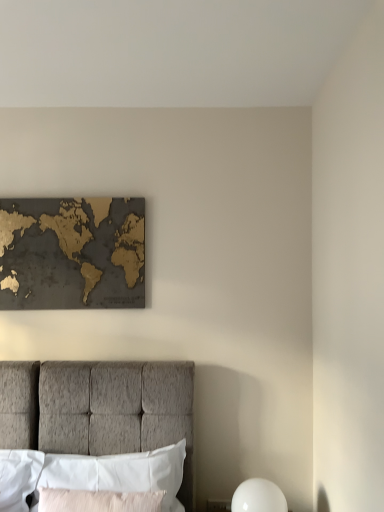
The image size is (384, 512). What do you see at coordinates (258, 497) in the screenshot?
I see `white glossy sphere at lower right` at bounding box center [258, 497].

Describe the element at coordinates (98, 501) in the screenshot. Image resolution: width=384 pixels, height=512 pixels. I see `light pink fabric pillow at lower center, the first pillow positioned from the front` at that location.

Identify the location of white glossy sphere at lower right. (258, 497).

Does white fabric pillow at lower left, positioned as the first pillow in back-to-front order, turn towards white glossy sphere at lower right?

No, white fabric pillow at lower left, positioned as the first pillow in back-to-front order, is not oriented towards white glossy sphere at lower right.

Is white glossy sphere at lower right a part of white fabric pillow at lower left, positioned as the first pillow in back-to-front order?

No, white glossy sphere at lower right is not a part of white fabric pillow at lower left, positioned as the first pillow in back-to-front order.

Considering the sizes of white fabric pillow at lower left, positioned as the first pillow in back-to-front order, and white glossy sphere at lower right in the image, is white fabric pillow at lower left, positioned as the first pillow in back-to-front order, bigger or smaller than white glossy sphere at lower right?

white fabric pillow at lower left, positioned as the first pillow in back-to-front order, is bigger than white glossy sphere at lower right.

I want to click on the 2nd pillow above when counting from the white glossy sphere at lower right (from the image's perspective), so click(120, 473).

In the scene shown: From a real-world perspective, between white fabric pillow at lower left, the 2th pillow in the front-to-back sequence, and light pink fabric pillow at lower center, the first pillow positioned from the front, who is vertically lower?

light pink fabric pillow at lower center, the first pillow positioned from the front, is physically lower.

Is white fabric pillow at lower left, positioned as the first pillow in back-to-front order, surrounding light pink fabric pillow at lower center, the first pillow positioned from the front?

No, light pink fabric pillow at lower center, the first pillow positioned from the front, is not inside white fabric pillow at lower left, positioned as the first pillow in back-to-front order.

Considering their positions, is white fabric pillow at lower left, the 2th pillow in the front-to-back sequence, located in front of or behind light pink fabric pillow at lower center, positioned as the 2th pillow in back-to-front order?

Visually, white fabric pillow at lower left, the 2th pillow in the front-to-back sequence, is located behind light pink fabric pillow at lower center, positioned as the 2th pillow in back-to-front order.

From the image's perspective, is gold metallic map at upper center above or below light pink fabric pillow at lower center, positioned as the 2th pillow in back-to-front order?

Based on their image positions, gold metallic map at upper center is located above light pink fabric pillow at lower center, positioned as the 2th pillow in back-to-front order.

Which is in front, gold metallic map at upper center or light pink fabric pillow at lower center, positioned as the 2th pillow in back-to-front order?

light pink fabric pillow at lower center, positioned as the 2th pillow in back-to-front order, is closer to the camera.

From a real-world perspective, between gold metallic map at upper center and light pink fabric pillow at lower center, positioned as the 2th pillow in back-to-front order, who is vertically higher?

gold metallic map at upper center, from a real-world perspective.

Which is behind, light pink fabric pillow at lower center, positioned as the 2th pillow in back-to-front order, or gold metallic map at upper center?

gold metallic map at upper center.

Is gold metallic map at upper center surrounded by light pink fabric pillow at lower center, the first pillow positioned from the front?

That's incorrect, gold metallic map at upper center is not inside light pink fabric pillow at lower center, the first pillow positioned from the front.

Could you tell me if white glossy sphere at lower right is turned towards light pink fabric pillow at lower center, positioned as the 2th pillow in back-to-front order?

No, white glossy sphere at lower right is not oriented towards light pink fabric pillow at lower center, positioned as the 2th pillow in back-to-front order.

From the image's perspective, who appears lower, white glossy sphere at lower right or light pink fabric pillow at lower center, the first pillow positioned from the front?

white glossy sphere at lower right.

Where is `pillow that is under the white glossy sphere at lower right (from a real-world perspective)`? This screenshot has width=384, height=512. pillow that is under the white glossy sphere at lower right (from a real-world perspective) is located at coordinates (98, 501).

Can you confirm if white glossy sphere at lower right is wider than light pink fabric pillow at lower center, the first pillow positioned from the front?

Yes, white glossy sphere at lower right is wider than light pink fabric pillow at lower center, the first pillow positioned from the front.

From a real-world perspective, relative to white fabric pillow at lower left, the 2th pillow in the front-to-back sequence, is gold metallic map at upper center vertically above or below?

A: gold metallic map at upper center is situated higher than white fabric pillow at lower left, the 2th pillow in the front-to-back sequence, in the real world.

Considering the positions of objects gold metallic map at upper center and white fabric pillow at lower left, the 2th pillow in the front-to-back sequence, in the image provided, who is behind, gold metallic map at upper center or white fabric pillow at lower left, the 2th pillow in the front-to-back sequence,?

gold metallic map at upper center is behind.

Would you say gold metallic map at upper center is inside or outside white fabric pillow at lower left, the 2th pillow in the front-to-back sequence?

gold metallic map at upper center lies outside white fabric pillow at lower left, the 2th pillow in the front-to-back sequence.

How much distance is there between white fabric pillow at lower left, positioned as the first pillow in back-to-front order, and gold metallic map at upper center?

The distance of white fabric pillow at lower left, positioned as the first pillow in back-to-front order, from gold metallic map at upper center is 36.84 inches.

In the scene shown: Is there a large distance between white fabric pillow at lower left, positioned as the first pillow in back-to-front order, and gold metallic map at upper center?

Actually, white fabric pillow at lower left, positioned as the first pillow in back-to-front order, and gold metallic map at upper center are a little close together.

Does white fabric pillow at lower left, positioned as the first pillow in back-to-front order, have a greater width compared to gold metallic map at upper center?

Correct, the width of white fabric pillow at lower left, positioned as the first pillow in back-to-front order, exceeds that of gold metallic map at upper center.

Between white fabric pillow at lower left, the 2th pillow in the front-to-back sequence, and gold metallic map at upper center, which one has smaller size?

gold metallic map at upper center is smaller.

Locate an element on the screen. bedside lamp on the right of white fabric pillow at lower left, positioned as the first pillow in back-to-front order is located at coordinates (258, 497).

The height and width of the screenshot is (512, 384). Find the location of `pillow positioned vertically above the light pink fabric pillow at lower center, positioned as the 2th pillow in back-to-front order (from a real-world perspective)`. pillow positioned vertically above the light pink fabric pillow at lower center, positioned as the 2th pillow in back-to-front order (from a real-world perspective) is located at coordinates (120, 473).

Based on their spatial positions, is gold metallic map at upper center or white fabric pillow at lower left, the 2th pillow in the front-to-back sequence, further from white glossy sphere at lower right?

Based on the image, gold metallic map at upper center appears to be further to white glossy sphere at lower right.

Looking at the image, which one is located closer to light pink fabric pillow at lower center, the first pillow positioned from the front, white fabric pillow at lower left, the 2th pillow in the front-to-back sequence, or gold metallic map at upper center?

white fabric pillow at lower left, the 2th pillow in the front-to-back sequence.

When comparing their distances from white glossy sphere at lower right, does gold metallic map at upper center or light pink fabric pillow at lower center, the first pillow positioned from the front, seem closer?

light pink fabric pillow at lower center, the first pillow positioned from the front, is closer to white glossy sphere at lower right.

Looking at the image, which one is located further to white glossy sphere at lower right, white fabric pillow at lower left, positioned as the first pillow in back-to-front order, or gold metallic map at upper center?

The object further to white glossy sphere at lower right is gold metallic map at upper center.

Looking at the image, which one is located further to light pink fabric pillow at lower center, positioned as the 2th pillow in back-to-front order, gold metallic map at upper center or white glossy sphere at lower right?

Based on the image, gold metallic map at upper center appears to be further to light pink fabric pillow at lower center, positioned as the 2th pillow in back-to-front order.

From the image, which object appears to be farther from gold metallic map at upper center, light pink fabric pillow at lower center, positioned as the 2th pillow in back-to-front order, or white fabric pillow at lower left, the 2th pillow in the front-to-back sequence?

Among the two, light pink fabric pillow at lower center, positioned as the 2th pillow in back-to-front order, is located further to gold metallic map at upper center.

Which object lies further to the anchor point white fabric pillow at lower left, positioned as the first pillow in back-to-front order, light pink fabric pillow at lower center, positioned as the 2th pillow in back-to-front order, or gold metallic map at upper center?

Based on the image, gold metallic map at upper center appears to be further to white fabric pillow at lower left, positioned as the first pillow in back-to-front order.

Consider the image. When comparing their distances from light pink fabric pillow at lower center, the first pillow positioned from the front, does white glossy sphere at lower right or white fabric pillow at lower left, the 2th pillow in the front-to-back sequence, seem further?

white glossy sphere at lower right is positioned further to the anchor light pink fabric pillow at lower center, the first pillow positioned from the front.

Identify the location of pillow between gold metallic map at upper center and light pink fabric pillow at lower center, positioned as the 2th pillow in back-to-front order, vertically. [x=120, y=473].

Image resolution: width=384 pixels, height=512 pixels. Identify the location of pillow situated between light pink fabric pillow at lower center, the first pillow positioned from the front, and white glossy sphere at lower right from left to right. (120, 473).